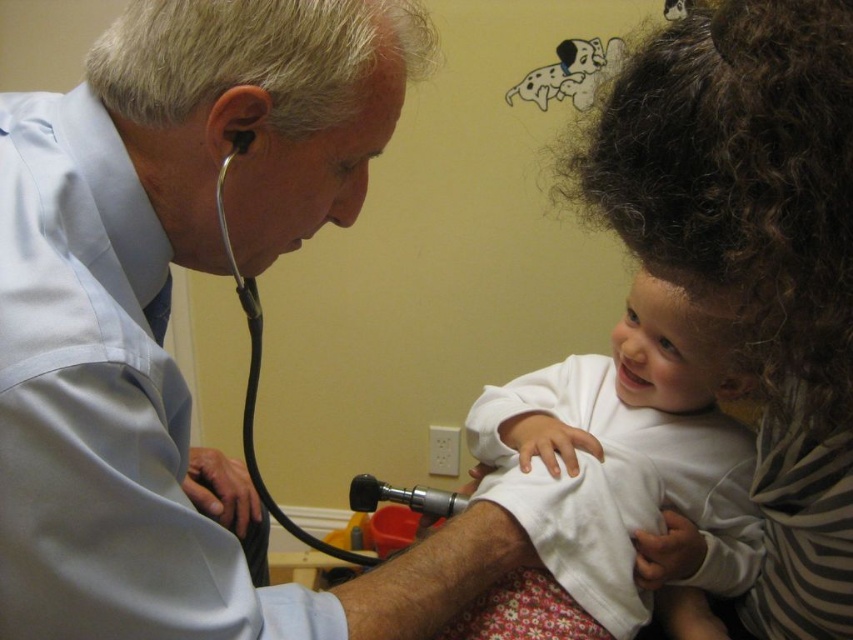
Question: Does curly brown hair at upper right have a smaller size compared to metallic black stethoscope at left?

Choices:
 (A) no
 (B) yes

Answer: (B)

Question: Which of the following is the closest to the observer?

Choices:
 (A) (364, 481)
 (B) (836, 483)
 (C) (682, 451)

Answer: (B)

Question: Estimate the real-world distances between objects in this image. Which object is closer to the curly brown hair at upper right?

Choices:
 (A) white soft baby at center
 (B) metallic black stethoscope at left

Answer: (A)

Question: Which point is farther to the camera?

Choices:
 (A) curly brown hair at upper right
 (B) white soft baby at center
 (C) metallic black stethoscope at left

Answer: (C)

Question: Where is white soft baby at center located in relation to metallic black stethoscope at left in the image?

Choices:
 (A) left
 (B) right

Answer: (B)

Question: Observing the image, what is the correct spatial positioning of white soft baby at center in reference to metallic black stethoscope at left?

Choices:
 (A) below
 (B) above

Answer: (B)